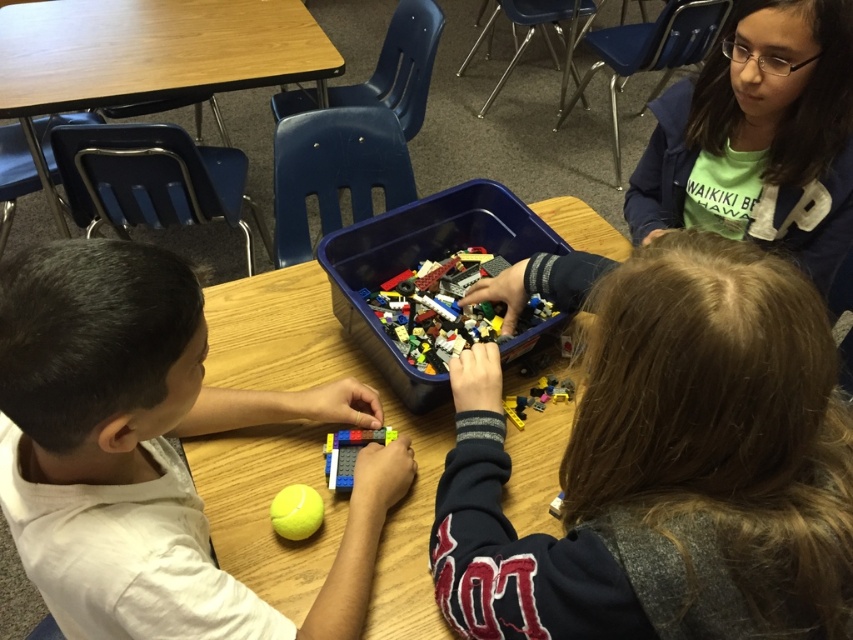
You are a teacher observing the classroom. You need to locate the matte plastic lego at center. Can you tell me its coordinates?

The matte plastic lego at center is located at coordinates point (x=123, y=365).

You are a child sitting at the wooden table in the classroom. You want to pick up the translucent plastic lego at center without touching the matte plastic lego at center. Is it possible?

The matte plastic lego at center is closer to the viewer than the translucent plastic lego at center, so you can reach the translucent plastic lego at center without touching the matte one by moving your hand around it.